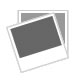
Find the location of a particular element. The height and width of the screenshot is (80, 80). picture behind is located at coordinates (43, 11).